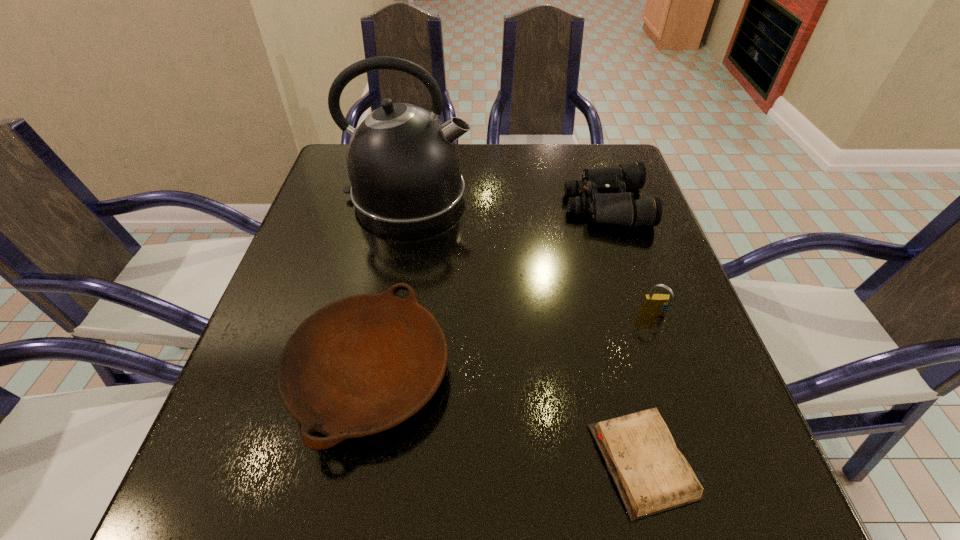
Locate an element on the screen. the second closest object to the padlock is located at coordinates (608, 202).